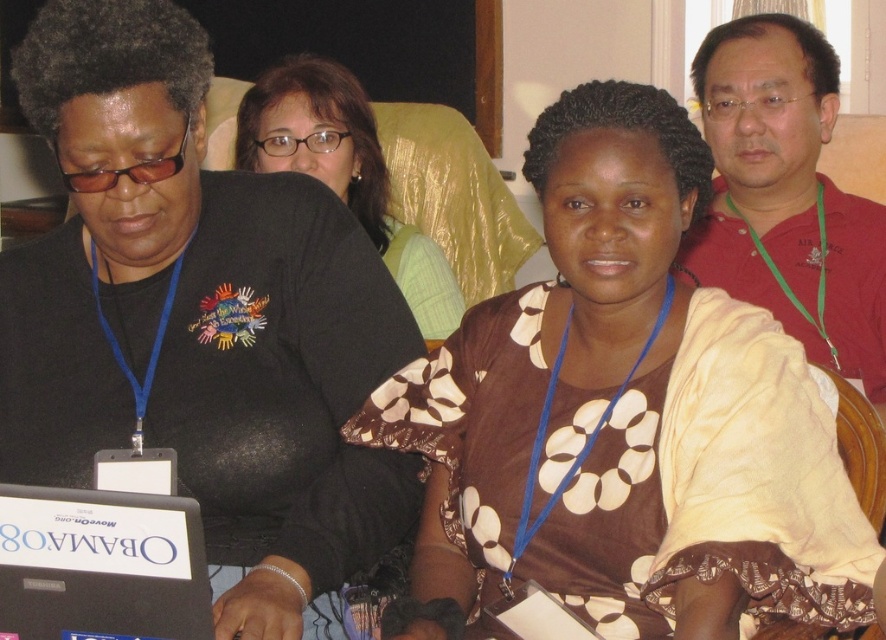
You are a photographer standing in front of the group. You want to take a photo of the brown dotted blouse at center and the red shirt at upper right. Which one will appear larger in your photo?

The brown dotted blouse at center will appear larger in the photo because it is closer to the viewer than the red shirt at upper right.

You are organizing a charity event and need to arrange two volunteers wearing the brown dotted blouse at center and brown textured blouse at center side by side. Based on their clothing, which volunteer should stand to the left to ensure there is enough space between them?

The volunteer wearing the brown dotted blouse at center should stand to the left since it might be wider than the brown textured blouse at center, allowing more space between them.

You are organizing a photo shoot and need to ensure that the brown dotted blouse at center and the black plastic laptop at lower left are both visible in the frame. Given their sizes, which object will require more horizontal space to fully capture in the photo?

The brown dotted blouse at center requires more horizontal space because its width surpasses that of the black plastic laptop at lower left.